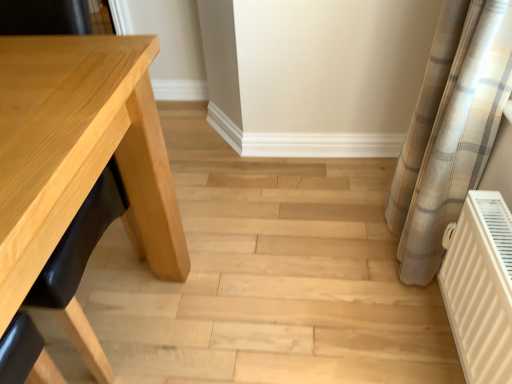
The width and height of the screenshot is (512, 384). Find the location of `vacant region under light wood table at left (from a real-world perspective)`. vacant region under light wood table at left (from a real-world perspective) is located at coordinates (101, 301).